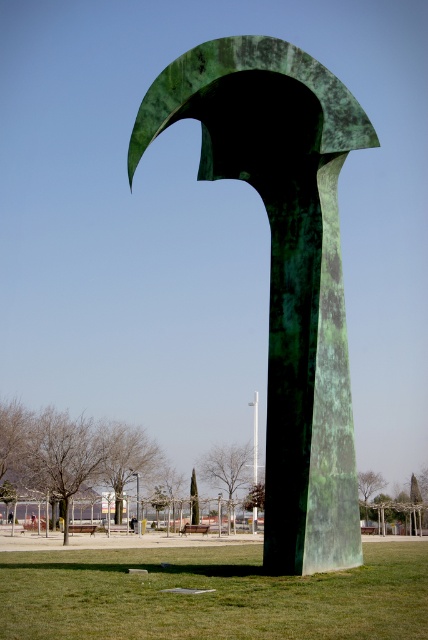
Question: Which point is closer to the camera taking this photo?

Choices:
 (A) (133, 557)
 (B) (151, 88)

Answer: (B)

Question: Which point is farther from the camera taking this photo?

Choices:
 (A) (350, 468)
 (B) (47, 588)

Answer: (A)

Question: Is green patinated metal arch at center above green grass at center?

Choices:
 (A) yes
 (B) no

Answer: (A)

Question: Which point is farther from the camera taking this photo?

Choices:
 (A) (86, 582)
 (B) (338, 352)

Answer: (B)

Question: Does green patinated metal arch at center appear on the left side of green grass at center?

Choices:
 (A) yes
 (B) no

Answer: (B)

Question: Can you confirm if green patinated metal arch at center is bigger than green grass at center?

Choices:
 (A) no
 (B) yes

Answer: (A)